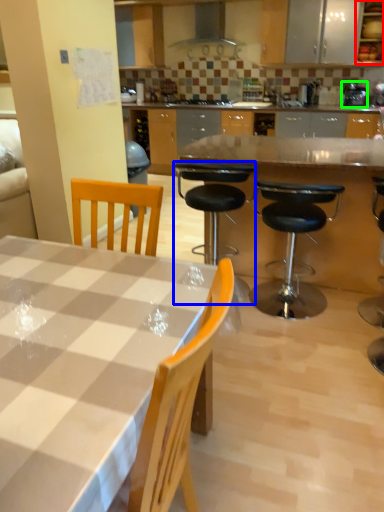
Question: Which is nearer to the cabinetry (highlighted by a red box)? chair (highlighted by a blue box) or appliance (highlighted by a green box).

Choices:
 (A) chair
 (B) appliance

Answer: (B)